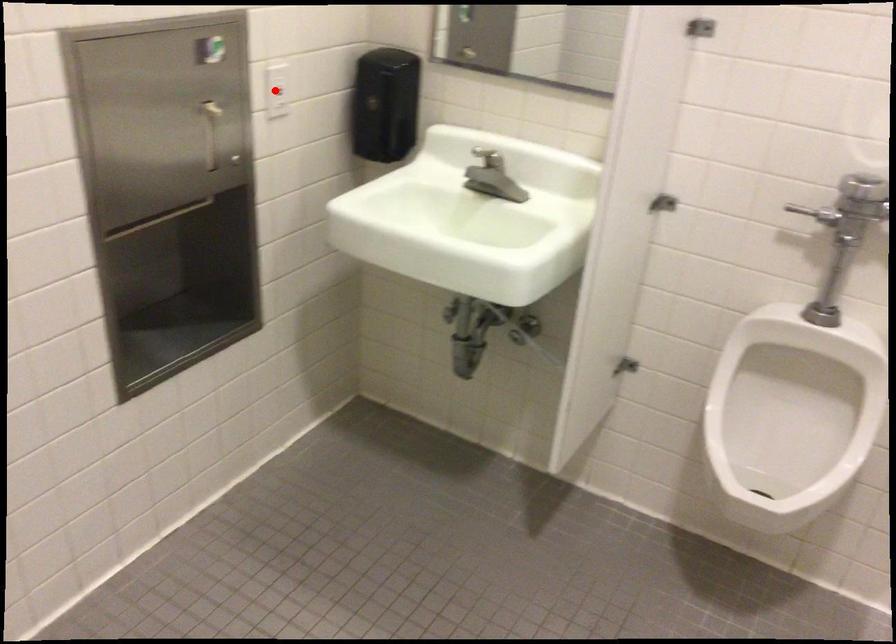
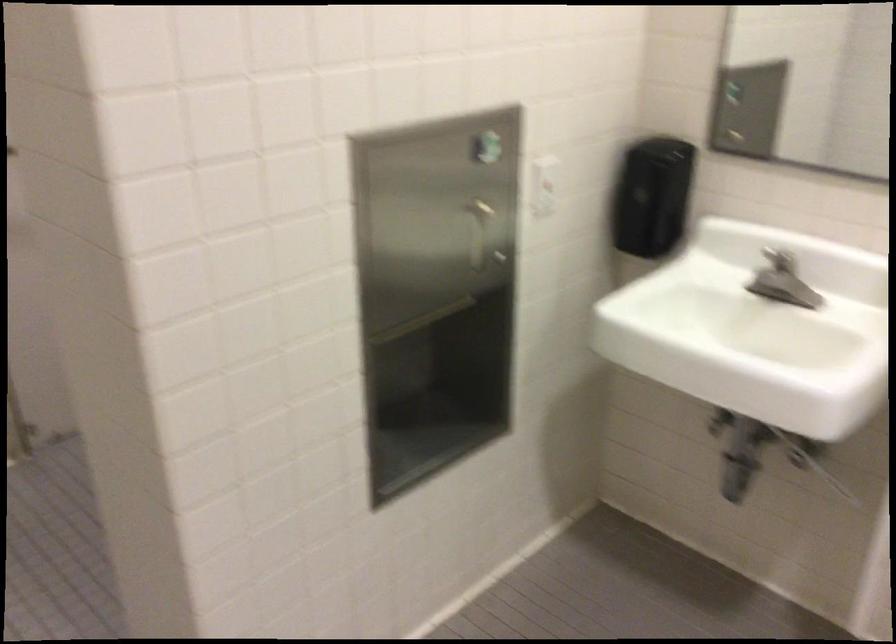
Locate, in the second image, the point that corresponds to the highlighted location in the first image.

(543, 185)